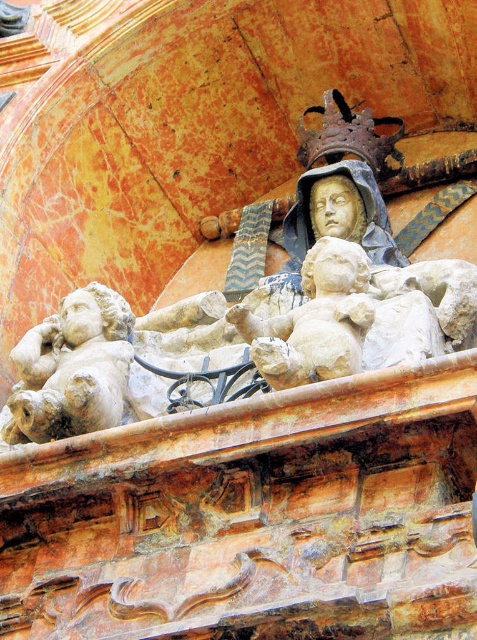
You are an art student analyzing the sculpture group. You notice two cherubs in the scene. Which one is thinner between the white marble cherub at lower left and the stone cherub at center?

The white marble cherub at lower left is thinner than the stone cherub at center according to the description.

You are an art conservator working on restoring the building facade. You need to move a ladder from the white marble cherub at lower left to the stone cherub at center. The ladder is 5 meters long. Will the ladder reach between the two cherubs?

Result: The white marble cherub at lower left is 5.67 meters from the stone cherub at center. Since the ladder is only 5 meters long, it will not be long enough to span the distance between the white marble cherub at lower left and the stone cherub at center.